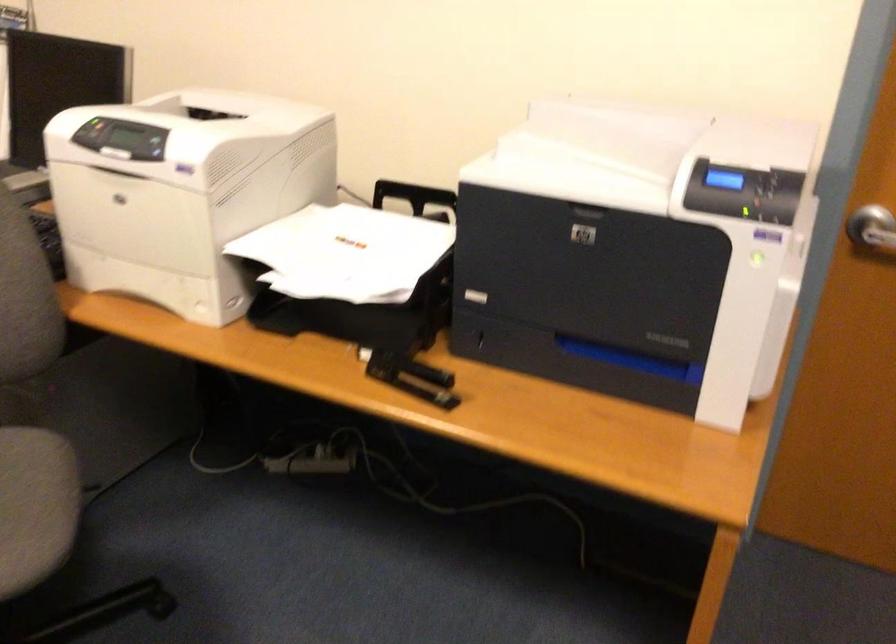
Where would you push the black stapler? Please return your answer as a coordinate pair (x, y).

(410, 377)